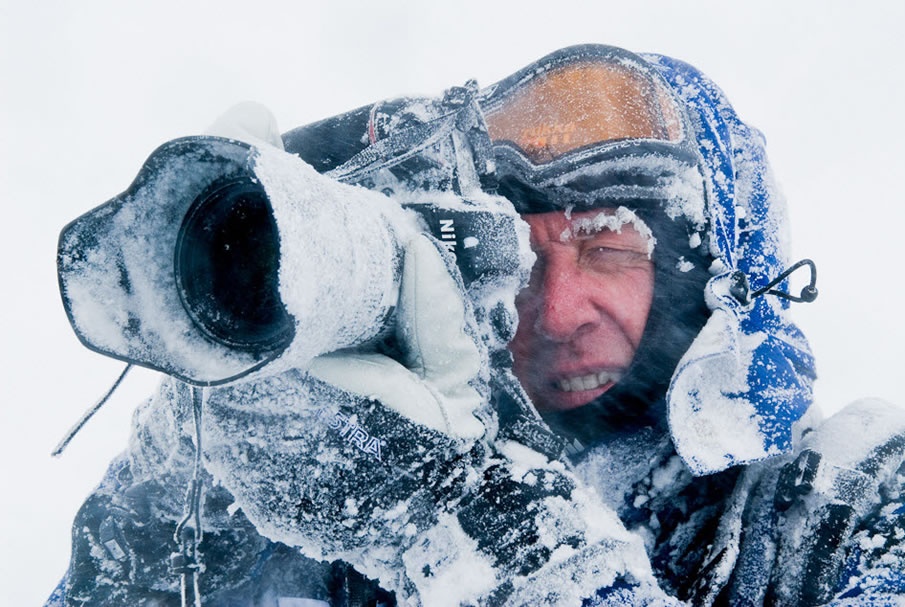
The height and width of the screenshot is (607, 905). I want to click on cord, so click(768, 282).